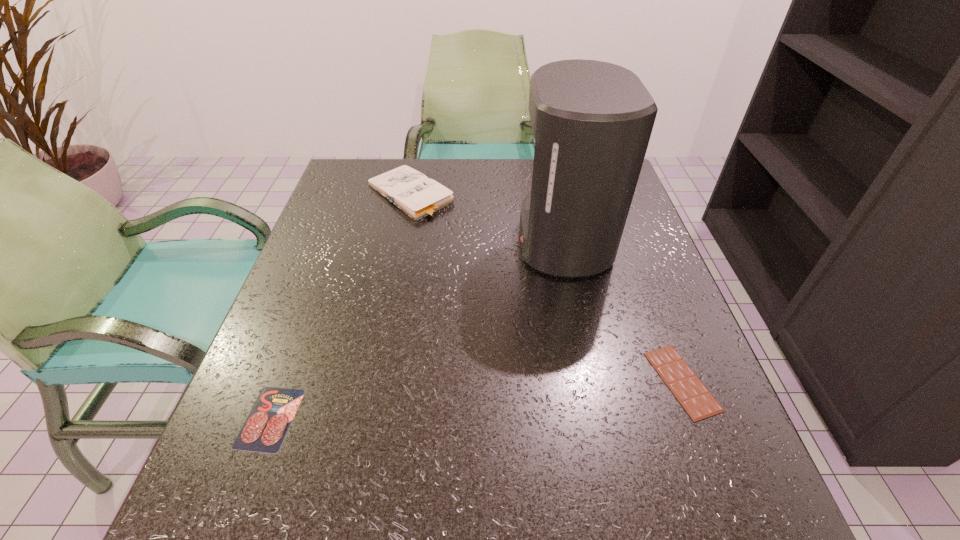
The width and height of the screenshot is (960, 540). What are the coordinates of `coffee maker` in the screenshot? It's located at (592, 121).

The image size is (960, 540). I want to click on the second tallest object, so click(419, 197).

Find the location of a particular element. The height and width of the screenshot is (540, 960). chocolate bar is located at coordinates (698, 402).

In order to click on salami in this screenshot , I will do `click(267, 424)`.

This screenshot has height=540, width=960. What are the coordinates of `vacant space located on the button side of the tallest object` in the screenshot? It's located at (420, 239).

Where is `blank area located 0.200m on the button side of the tallest object`? This screenshot has height=540, width=960. blank area located 0.200m on the button side of the tallest object is located at coordinates (433, 239).

Locate an element on the screen. This screenshot has width=960, height=540. vacant position located on the button side of the tallest object is located at coordinates (399, 239).

Where is `vacant area situated on the right of the second tallest object`? The width and height of the screenshot is (960, 540). vacant area situated on the right of the second tallest object is located at coordinates (540, 194).

Locate an element on the screen. This screenshot has height=540, width=960. vacant space located on the front of the chocolate bar is located at coordinates (711, 460).

Locate an element on the screen. free space located 0.080m on the front of the salami is located at coordinates pyautogui.click(x=236, y=510).